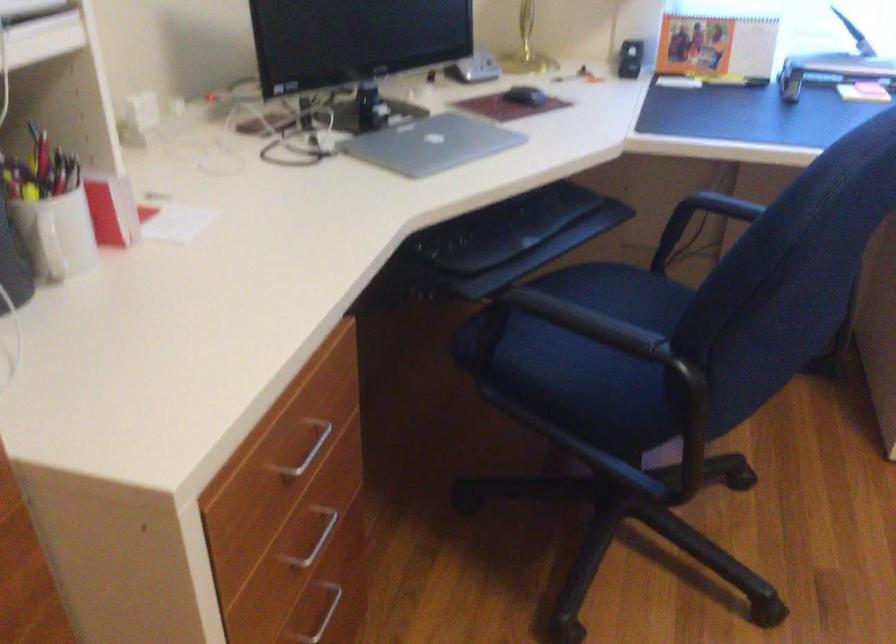
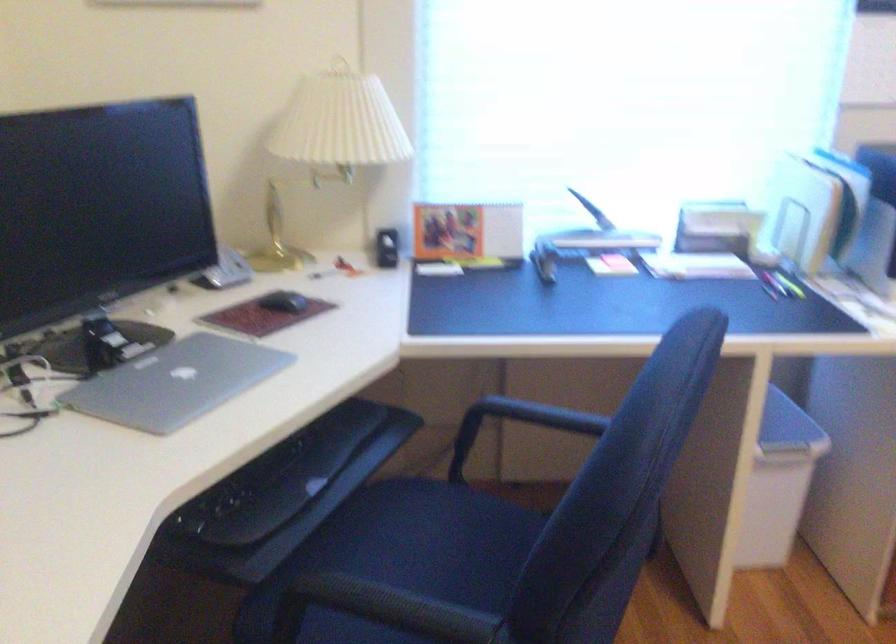
Question: The camera is either moving clockwise (left) or counter-clockwise (right) around the object. The first image is from the beginning of the video and the second image is from the end. Is the camera moving left or right when shooting the video?

Choices:
 (A) Left
 (B) Right

Answer: (A)